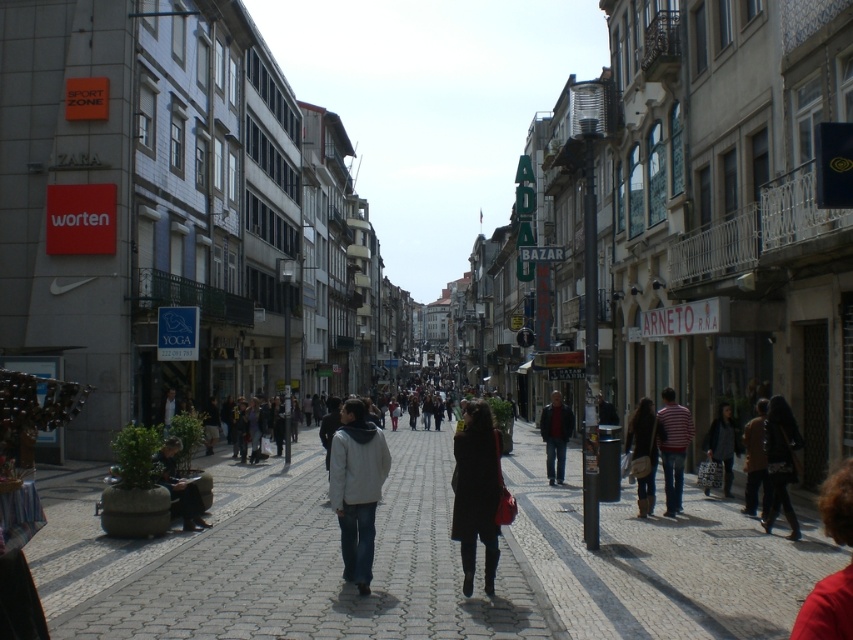
Between light gray jacket at center and striped cotton shirt at lower right, which one is positioned lower?

light gray jacket at center is below.

Does light gray jacket at center appear on the right side of striped cotton shirt at lower right?

No, light gray jacket at center is not to the right of striped cotton shirt at lower right.

Is point (345, 547) positioned before point (668, 490)?

Yes, point (345, 547) is in front of point (668, 490).

What are the coordinates of `light gray jacket at center` in the screenshot? It's located at (357, 488).

Which of these two, gray cobblestone pavement at center or brown leather boots at lower right, stands shorter?

Standing shorter between the two is brown leather boots at lower right.

Does gray cobblestone pavement at center have a lesser height compared to brown leather boots at lower right?

Incorrect, gray cobblestone pavement at center's height does not fall short of brown leather boots at lower right's.

Identify the location of gray cobblestone pavement at center. (282, 560).

The height and width of the screenshot is (640, 853). Find the location of `gray cobblestone pavement at center`. gray cobblestone pavement at center is located at coordinates (282, 560).

Is point (505, 547) positioned in front of point (192, 522)?

Yes, point (505, 547) is in front of point (192, 522).

Which of these two, gray cobblestone pavement at center or matte black jacket at lower left, stands taller?

With more height is gray cobblestone pavement at center.

Where is `gray cobblestone pavement at center`? The height and width of the screenshot is (640, 853). gray cobblestone pavement at center is located at coordinates (282, 560).